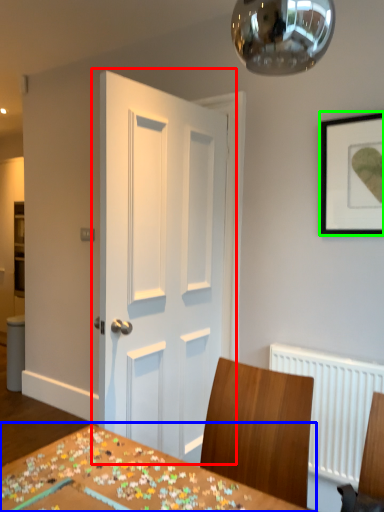
Question: Which is farther away from door (highlighted by a red box)? table (highlighted by a blue box) or picture frame (highlighted by a green box)?

Choices:
 (A) table
 (B) picture frame

Answer: (A)